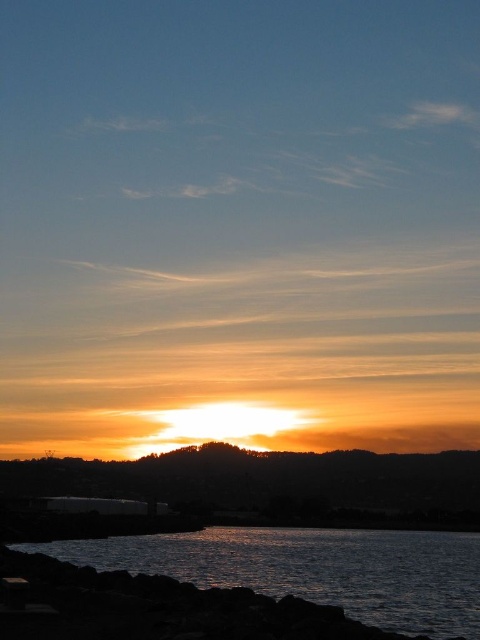
Between point (231, 497) and point (397, 552), which one is positioned behind?

Positioned behind is point (231, 497).

Which is above, golden sky at center or dark reflective water at lower left?

dark reflective water at lower left is above.

Does point (257, 464) come closer to viewer compared to point (380, 616)?

No, it is not.

Locate an element on the screen. This screenshot has height=640, width=480. golden sky at center is located at coordinates (275, 484).